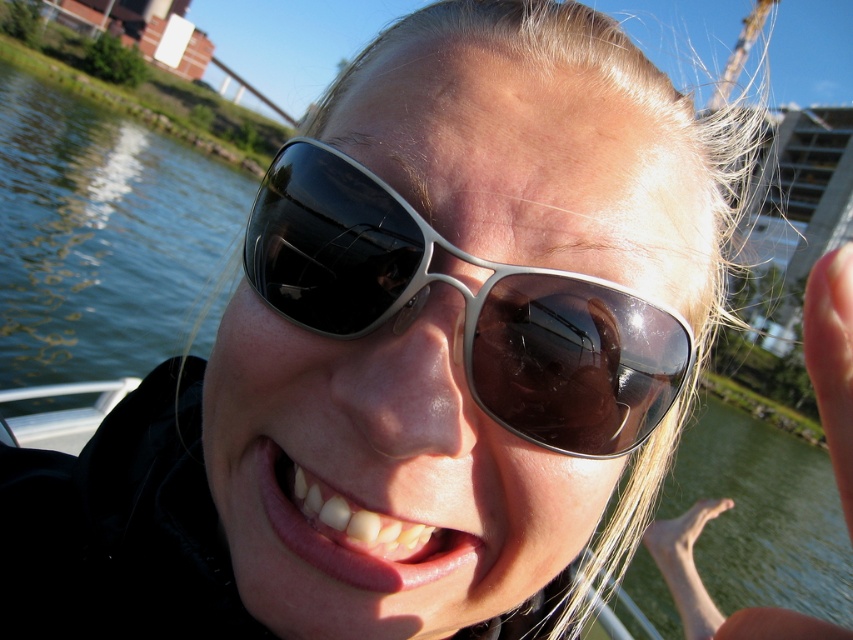
Question: Is metallic silver aviator sunglasses at center above pink glossy lips at center?

Choices:
 (A) yes
 (B) no

Answer: (A)

Question: Considering the real-world distances, which object is farthest from the pink glossy lips at center?

Choices:
 (A) metallic silver aviator sunglasses at center
 (B) clear water at lower left

Answer: (B)

Question: Which is farther from the metallic silver aviator sunglasses at center?

Choices:
 (A) clear water at lower left
 (B) pink glossy lips at center

Answer: (A)

Question: Is clear water at lower left to the left of pink glossy lips at center from the viewer's perspective?

Choices:
 (A) no
 (B) yes

Answer: (B)

Question: Considering the relative positions of metallic silver aviator sunglasses at center and pink glossy lips at center in the image provided, where is metallic silver aviator sunglasses at center located with respect to pink glossy lips at center?

Choices:
 (A) right
 (B) left

Answer: (A)

Question: Estimate the real-world distances between objects in this image. Which object is farther from the clear water at lower left?

Choices:
 (A) metallic silver aviator sunglasses at center
 (B) pink glossy lips at center

Answer: (B)